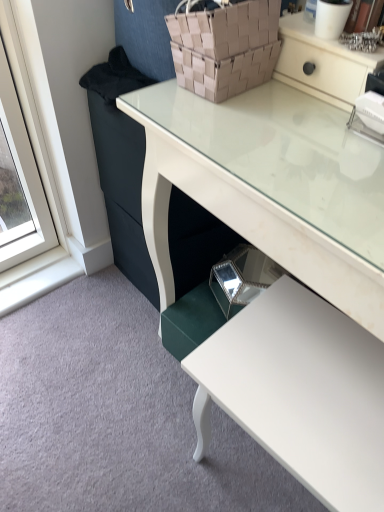
Question: From the image's perspective, relative to white glossy table at lower right, is brown woven basket at upper center above or below?

Choices:
 (A) above
 (B) below

Answer: (A)

Question: Looking at their shapes, would you say brown woven basket at upper center is wider or thinner than white glossy table at lower right?

Choices:
 (A) wide
 (B) thin

Answer: (B)

Question: Which of these objects is positioned farthest from the white glossy table at lower right?

Choices:
 (A) white glossy desk at center
 (B) brown woven basket at upper center

Answer: (B)

Question: Estimate the real-world distances between objects in this image. Which object is farther from the brown woven basket at upper center?

Choices:
 (A) white glossy desk at center
 (B) white glossy table at lower right

Answer: (B)